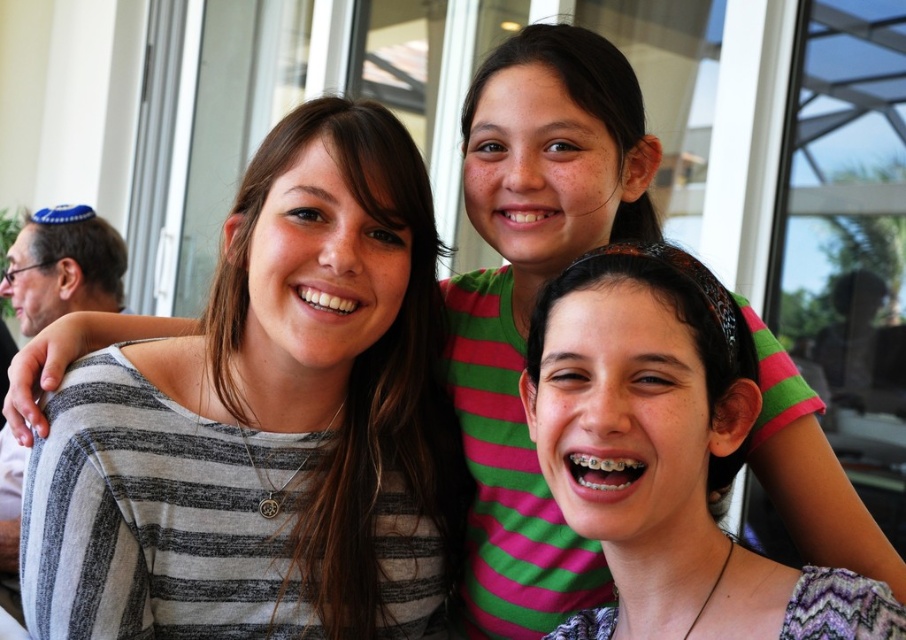
Looking at the image, which object is closer to the camera between the multicolored woven headband at center and the blue fabric kippah at upper left?

The multicolored woven headband at center is closer to the camera because it is positioned under the blue fabric kippah at upper left, indicating it is in front.

You are taking a photo of three people and notice the gray striped shirt at upper left and the blue fabric kippah at upper left. Which object is closer to the camera?

The gray striped shirt at upper left is taller than blue fabric kippah at upper left, so the gray striped shirt at upper left is closer to the camera since it appears larger in the image.

You are taking a photo and want to ensure the gray striped shirt at upper left is centered in the frame. According to the coordinates provided, what adjustment should you make to the camera position?

The gray striped shirt at upper left is currently at coordinates point (267,422). To center it, move the camera slightly to the left and downward since the current position is to the right and above the center point.